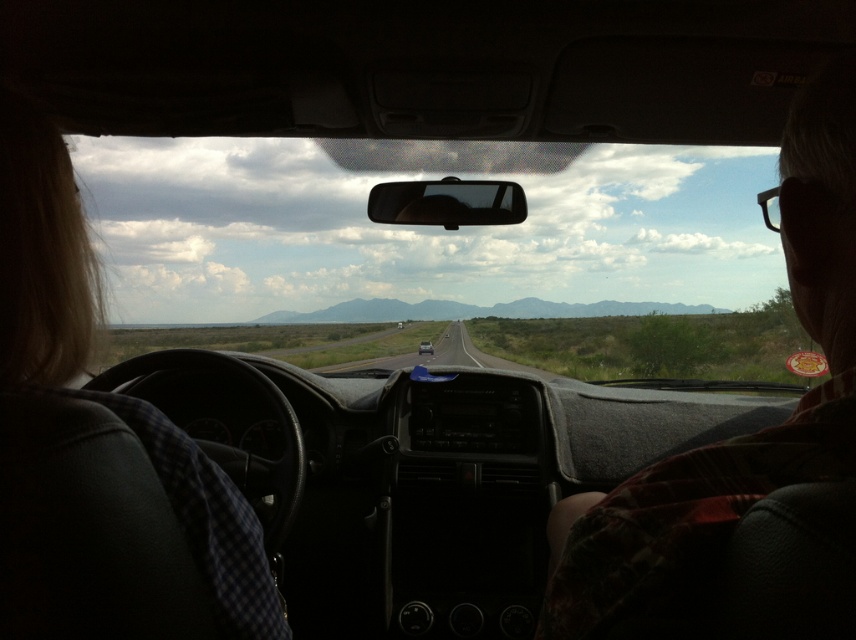
Question: Can you confirm if blonde hair at left is positioned above asphalt road at center?

Choices:
 (A) yes
 (B) no

Answer: (A)

Question: Which object is the closest to the asphalt road at center?

Choices:
 (A) transparent glass windshield at center
 (B) plaid shirt at right
 (C) metallic silver sedan at center

Answer: (C)

Question: Can you confirm if transparent glass windshield at center is thinner than plaid shirt at right?

Choices:
 (A) no
 (B) yes

Answer: (A)

Question: Among these points, which one is farthest from the camera?

Choices:
 (A) (812, 81)
 (B) (188, 538)
 (C) (423, 342)

Answer: (C)

Question: Is blonde hair at left closer to the viewer compared to asphalt road at center?

Choices:
 (A) no
 (B) yes

Answer: (B)

Question: Which point appears farthest from the camera in this image?

Choices:
 (A) (198, 454)
 (B) (670, 230)
 (C) (419, 349)
 (D) (593, 573)

Answer: (C)